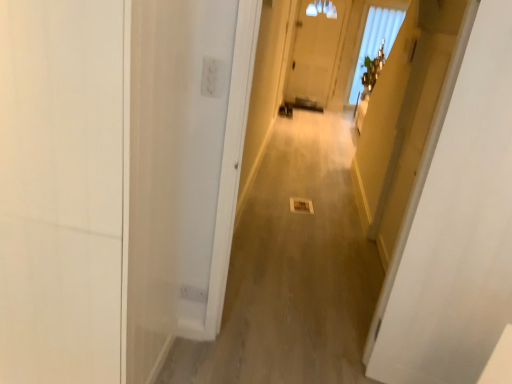
Locate an element on the screen. translucent glass window at upper center is located at coordinates (375, 41).

The height and width of the screenshot is (384, 512). Identify the location of white matte door at left, the 1th door viewed from the left. (61, 190).

Is white matte door at left, positioned as the second door in right-to-left order, wider than white glossy door at upper right, acting as the second door starting from the left?

Correct, the width of white matte door at left, positioned as the second door in right-to-left order, exceeds that of white glossy door at upper right, acting as the second door starting from the left.

From a real-world perspective, between white matte door at left, positioned as the second door in right-to-left order, and white glossy door at upper right, arranged as the first door when viewed from the right, who is vertically higher?

From a 3D spatial view, white glossy door at upper right, arranged as the first door when viewed from the right, is above.

Considering the points (53, 69) and (446, 235), which point is behind, point (53, 69) or point (446, 235)?

The point (446, 235) is farther.

Is the depth of white matte door at left, positioned as the second door in right-to-left order, greater than that of white glossy door at upper right, arranged as the first door when viewed from the right?

No, white matte door at left, positioned as the second door in right-to-left order, is closer to the viewer.

Where is `alley behind the white glossy door at upper right, arranged as the first door when viewed from the right`? alley behind the white glossy door at upper right, arranged as the first door when viewed from the right is located at coordinates (293, 271).

Which object is wider, white glossy door at upper right, arranged as the first door when viewed from the right, or smooth beige carpet at center?

smooth beige carpet at center.

What's the angular difference between white glossy door at upper right, arranged as the first door when viewed from the right, and smooth beige carpet at center's facing directions?

There is a 17.6-degree angle between the facing directions of white glossy door at upper right, arranged as the first door when viewed from the right, and smooth beige carpet at center.

Would you say white glossy door at upper right, acting as the second door starting from the left, is inside or outside smooth beige carpet at center?

The correct answer is: outside.

Between white matte door at left, positioned as the second door in right-to-left order, and smooth beige carpet at center, which one has larger width?

Wider between the two is smooth beige carpet at center.

Is point (0, 245) closer or farther from the camera than point (268, 330)?

Point (0, 245) is positioned closer to the camera compared to point (268, 330).

Looking at this image, from a real-world perspective, who is located lower, white matte door at left, the 1th door viewed from the left, or smooth beige carpet at center?

smooth beige carpet at center is physically lower.

In order to click on the 1st door located above the smooth beige carpet at center (from a real-world perspective) in this screenshot , I will do `click(61, 190)`.

Can you confirm if smooth beige carpet at center is positioned to the left of white matte door at left, the 1th door viewed from the left?

No.

From the picture: How many degrees apart are the facing directions of smooth beige carpet at center and white matte door at left, positioned as the second door in right-to-left order?

0.168 degrees separate the facing orientations of smooth beige carpet at center and white matte door at left, positioned as the second door in right-to-left order.

Could you tell me if smooth beige carpet at center is turned towards white matte door at left, positioned as the second door in right-to-left order?

No, smooth beige carpet at center is not turned towards white matte door at left, positioned as the second door in right-to-left order.

Does smooth beige carpet at center have a smaller size compared to white matte door at left, positioned as the second door in right-to-left order?

Yes, smooth beige carpet at center is smaller than white matte door at left, positioned as the second door in right-to-left order.

Is translucent glass window at upper center bigger or smaller than white glossy door at upper right, arranged as the first door when viewed from the right?

translucent glass window at upper center is bigger than white glossy door at upper right, arranged as the first door when viewed from the right.

Considering the points (368, 17) and (510, 224), which point is behind, point (368, 17) or point (510, 224)?

Point (368, 17)

Would you say translucent glass window at upper center is a long distance from white glossy door at upper right, arranged as the first door when viewed from the right?

Yes, translucent glass window at upper center and white glossy door at upper right, arranged as the first door when viewed from the right, are quite far apart.

Considering the relative sizes of translucent glass window at upper center and white glossy door at upper right, arranged as the first door when viewed from the right, in the image provided, is translucent glass window at upper center shorter than white glossy door at upper right, arranged as the first door when viewed from the right,?

Incorrect, the height of translucent glass window at upper center does not fall short of that of white glossy door at upper right, arranged as the first door when viewed from the right.

Which of these two, white matte door at left, positioned as the second door in right-to-left order, or translucent glass window at upper center, stands shorter?

Standing shorter between the two is white matte door at left, positioned as the second door in right-to-left order.

Considering the relative positions of white matte door at left, the 1th door viewed from the left, and translucent glass window at upper center in the image provided, is white matte door at left, the 1th door viewed from the left, to the right of translucent glass window at upper center from the viewer's perspective?

In fact, white matte door at left, the 1th door viewed from the left, is to the left of translucent glass window at upper center.

Can you tell me how much white matte door at left, positioned as the second door in right-to-left order, and translucent glass window at upper center differ in facing direction?

The angular difference between white matte door at left, positioned as the second door in right-to-left order, and translucent glass window at upper center is 0.903 degrees.

Which object is wider, white matte door at left, the 1th door viewed from the left, or translucent glass window at upper center?

With larger width is white matte door at left, the 1th door viewed from the left.

Find the location of a particular element. alley in front of the translucent glass window at upper center is located at coordinates (293, 271).

Which object is closer to the camera taking this photo, smooth beige carpet at center or translucent glass window at upper center?

smooth beige carpet at center is more forward.

Between point (312, 261) and point (357, 92), which one is positioned in front?

The point (312, 261) is closer.

Locate an element on the screen. This screenshot has width=512, height=384. door that appears above the white matte door at left, positioned as the second door in right-to-left order (from a real-world perspective) is located at coordinates (455, 224).

Identify the location of alley behind the white glossy door at upper right, acting as the second door starting from the left. (293, 271).

Estimate the real-world distances between objects in this image. Which object is closer to smooth beige carpet at center, white matte door at left, positioned as the second door in right-to-left order, or translucent glass window at upper center?

Among the two, white matte door at left, positioned as the second door in right-to-left order, is located nearer to smooth beige carpet at center.

From the image, which object appears to be nearer to smooth beige carpet at center, white matte door at left, positioned as the second door in right-to-left order, or white glossy door at upper right, acting as the second door starting from the left?

Among the two, white glossy door at upper right, acting as the second door starting from the left, is located nearer to smooth beige carpet at center.

When comparing their distances from white matte door at left, positioned as the second door in right-to-left order, does white glossy door at upper right, arranged as the first door when viewed from the right, or translucent glass window at upper center seem closer?

white glossy door at upper right, arranged as the first door when viewed from the right, is positioned closer to the anchor white matte door at left, positioned as the second door in right-to-left order.

Looking at the image, which one is located closer to white glossy door at upper right, acting as the second door starting from the left, smooth beige carpet at center or translucent glass window at upper center?

smooth beige carpet at center is positioned closer to the anchor white glossy door at upper right, acting as the second door starting from the left.

Considering their positions, is white matte door at left, positioned as the second door in right-to-left order, positioned further to translucent glass window at upper center than white glossy door at upper right, acting as the second door starting from the left?

white matte door at left, positioned as the second door in right-to-left order, is further to translucent glass window at upper center.

Based on their spatial positions, is white glossy door at upper right, arranged as the first door when viewed from the right, or white matte door at left, the 1th door viewed from the left, further from smooth beige carpet at center?

white matte door at left, the 1th door viewed from the left, is positioned further to the anchor smooth beige carpet at center.

Looking at the image, which one is located further to white matte door at left, positioned as the second door in right-to-left order, smooth beige carpet at center or white glossy door at upper right, arranged as the first door when viewed from the right?

Among the two, smooth beige carpet at center is located further to white matte door at left, positioned as the second door in right-to-left order.

Which object lies further to the anchor point white matte door at left, the 1th door viewed from the left, smooth beige carpet at center or translucent glass window at upper center?

The object further to white matte door at left, the 1th door viewed from the left, is translucent glass window at upper center.

I want to click on alley situated between white matte door at left, positioned as the second door in right-to-left order, and white glossy door at upper right, acting as the second door starting from the left, from left to right, so click(x=293, y=271).

Locate an element on the screen. This screenshot has width=512, height=384. alley between white glossy door at upper right, arranged as the first door when viewed from the right, and translucent glass window at upper center, along the z-axis is located at coordinates (293, 271).

In order to click on alley between white matte door at left, positioned as the second door in right-to-left order, and translucent glass window at upper center, along the z-axis in this screenshot , I will do `click(293, 271)`.

In order to click on door between white matte door at left, the 1th door viewed from the left, and translucent glass window at upper center from front to back in this screenshot , I will do `click(455, 224)`.